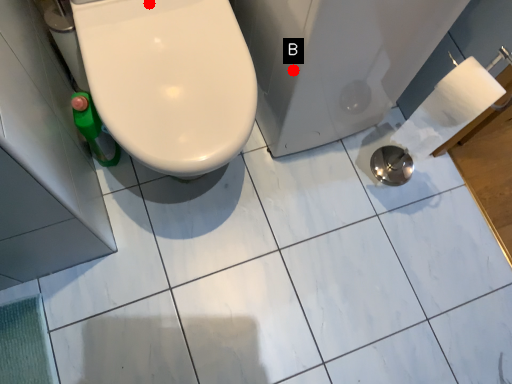
Question: Two points are circled on the image, labeled by A and B beside each circle. Which of the following is the closest to the observer?

Choices:
 (A) A is closer
 (B) B is closer

Answer: (B)